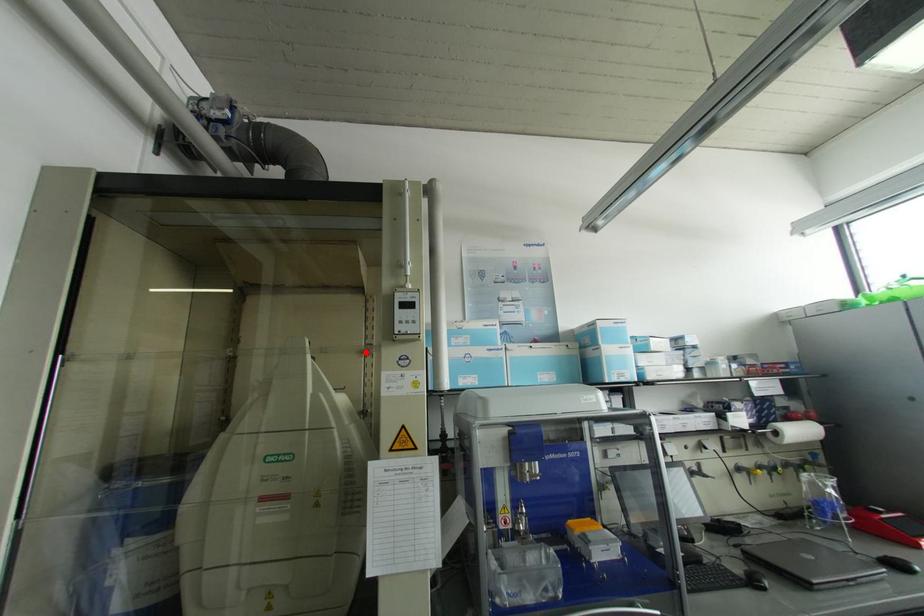
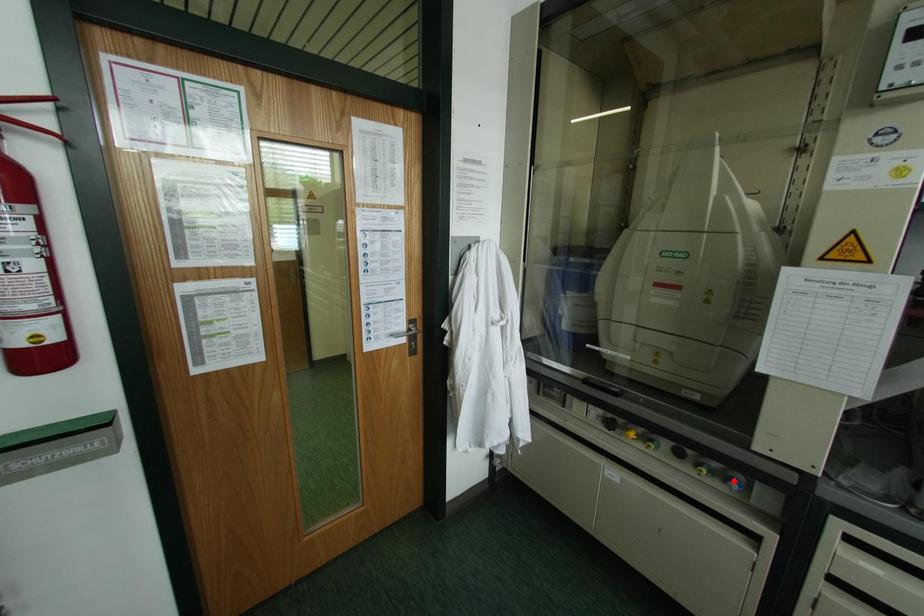
I am providing you with two images of the same scene from different viewpoints. A red point is marked on the first image and another point is marked on the second image. Is the red point in image1 aligned with the point shown in image2?

No